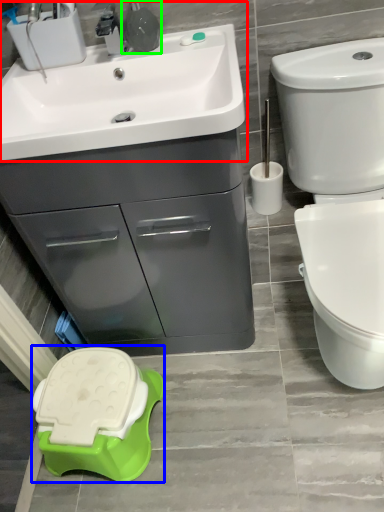
Question: Which is farther away from sink (highlighted by a red box)? porcelain (highlighted by a blue box) or plumbing fixture (highlighted by a green box)?

Choices:
 (A) porcelain
 (B) plumbing fixture

Answer: (A)